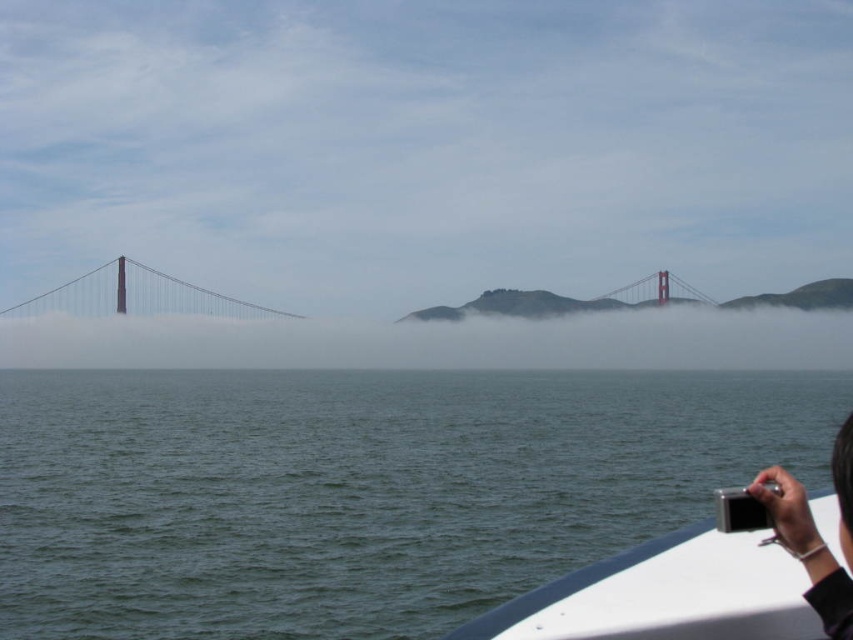
Question: Which of the following is the farthest from the observer?

Choices:
 (A) (683, 284)
 (B) (769, 564)
 (C) (200, 296)
 (D) (289, 609)

Answer: (A)

Question: Which of these objects is positioned farthest from the white plastic boat at lower right?

Choices:
 (A) green water at lower left
 (B) black matte camera at lower right
 (C) metallic bridge at center

Answer: (C)

Question: Can you confirm if metallic suspension bridge at left is positioned to the left of metallic bridge at center?

Choices:
 (A) yes
 (B) no

Answer: (A)

Question: Which point is farther to the camera?

Choices:
 (A) (828, 550)
 (B) (120, 291)
 (C) (688, 572)
 (D) (701, 296)

Answer: (D)

Question: Does white plastic boat at lower right have a larger size compared to black matte camera at lower right?

Choices:
 (A) yes
 (B) no

Answer: (B)

Question: Observing the image, what is the correct spatial positioning of green water at lower left in reference to metallic suspension bridge at left?

Choices:
 (A) below
 (B) above

Answer: (A)